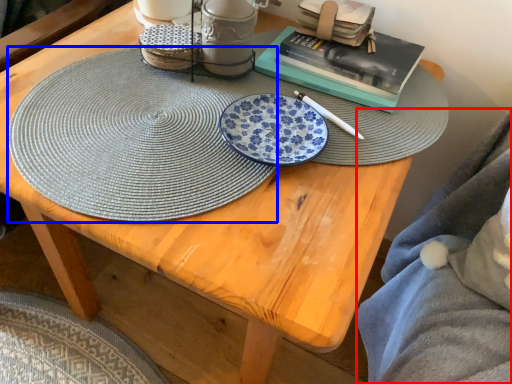
Question: Which object appears farthest to the camera in this image, blanket (highlighted by a red box) or platter (highlighted by a blue box)?

Choices:
 (A) blanket
 (B) platter

Answer: (B)